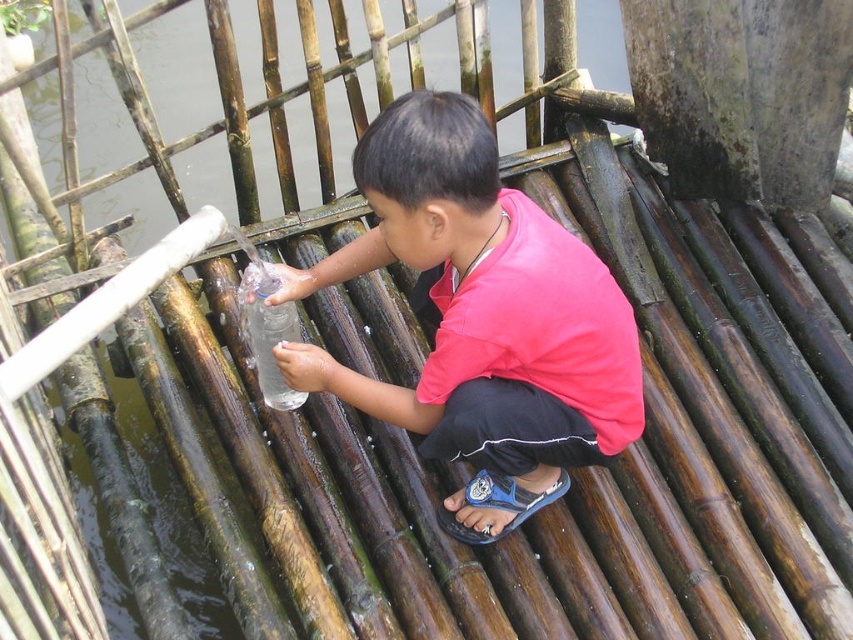
Question: Considering the relative positions of matte plastic bottle at center and clear plastic bottle at center in the image provided, where is matte plastic bottle at center located with respect to clear plastic bottle at center?

Choices:
 (A) above
 (B) below

Answer: (B)

Question: Based on their relative distances, which object is nearer to the transparent plastic water at center?

Choices:
 (A) clear plastic bottle at center
 (B) matte plastic bottle at center

Answer: (A)

Question: Observing the image, what is the correct spatial positioning of transparent plastic water at center in reference to matte plastic bottle at center?

Choices:
 (A) above
 (B) below

Answer: (A)

Question: Is the position of transparent plastic water at center more distant than that of clear plastic bottle at center?

Choices:
 (A) no
 (B) yes

Answer: (A)

Question: Among these points, which one is nearest to the camera?

Choices:
 (A) (177, 332)
 (B) (294, 312)
 (C) (386, 259)

Answer: (C)

Question: Which point is closer to the camera?

Choices:
 (A) clear plastic bottle at center
 (B) transparent plastic water at center

Answer: (B)